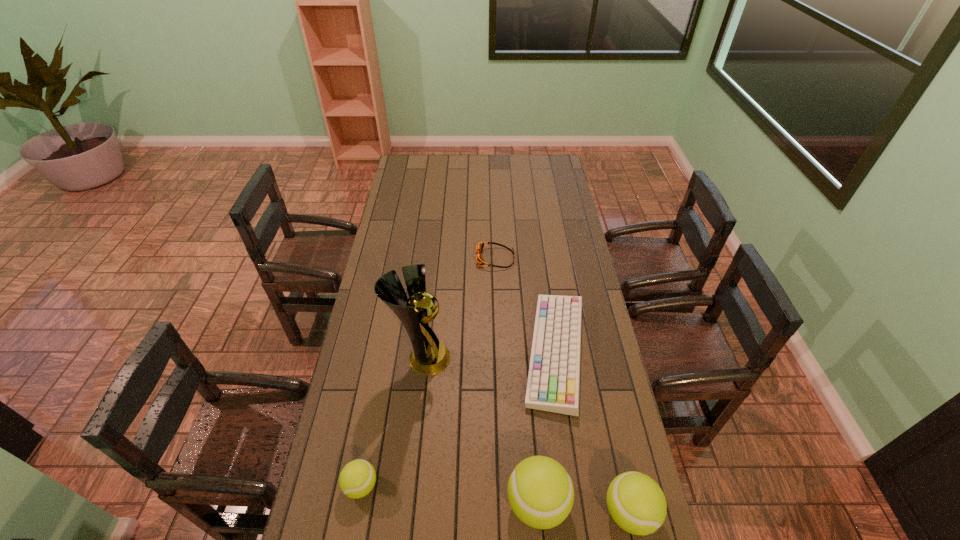
Identify the location of vacant space located on the back of the computer keyboard. (544, 274).

Where is `free space located 0.320m with the lenses facing forward on the farthest object`? The width and height of the screenshot is (960, 540). free space located 0.320m with the lenses facing forward on the farthest object is located at coordinates (403, 258).

The image size is (960, 540). In order to click on free location located with the lenses facing forward on the farthest object in this screenshot , I will do `click(406, 258)`.

Locate an element on the screen. The image size is (960, 540). vacant space situated with the lenses facing forward on the farthest object is located at coordinates (410, 258).

Identify the location of tennis ball located at the left edge. (357, 479).

At what (x,y) coordinates should I click in order to perform the action: click on award that is positioned at the left edge. Please return your answer as a coordinate pair (x, y). Looking at the image, I should click on (429, 356).

Where is `object that is at the right edge`? object that is at the right edge is located at coordinates pos(553,384).

This screenshot has width=960, height=540. I want to click on object that is at the near left corner, so click(x=357, y=479).

Find the location of a particular element. This screenshot has width=960, height=540. vacant space at the far edge is located at coordinates (476, 167).

Locate an element on the screen. blank space at the left edge of the desktop is located at coordinates (397, 334).